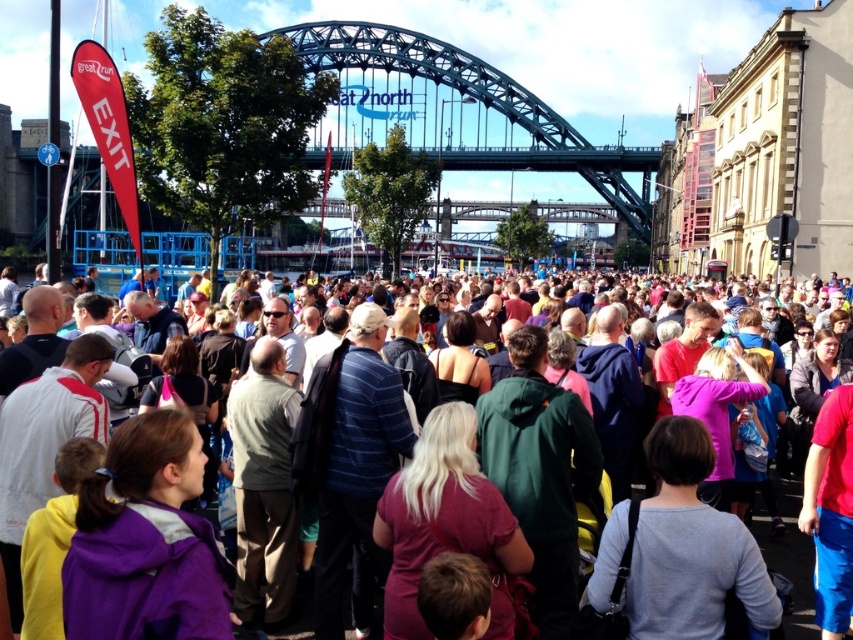
Is the position of green steel bridge at center less distant than that of multicolored clothing at center?

That is False.

Is green steel bridge at center further to the viewer compared to multicolored clothing at center?

Yes, green steel bridge at center is behind multicolored clothing at center.

Is point (495, 125) behind point (790, 637)?

Yes, it is behind point (790, 637).

The height and width of the screenshot is (640, 853). I want to click on green steel bridge at center, so click(456, 113).